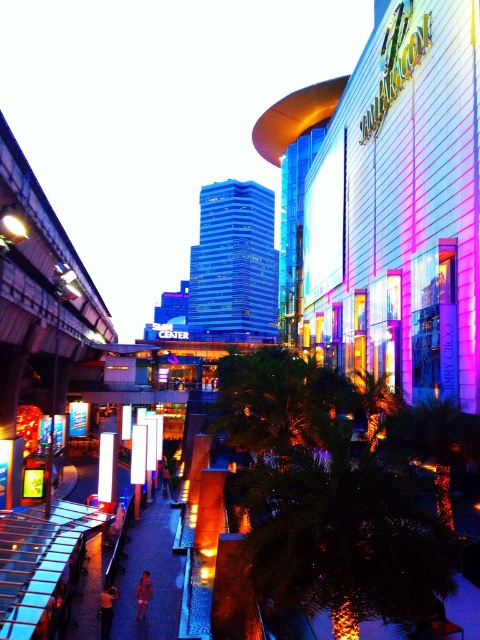
You are a photographer standing at the entrance of the shopping complex and see the orange fabric shirt at lower left and the pink fabric person at center in your viewfinder. Which object appears shorter in the photo?

The orange fabric shirt at lower left appears shorter than the pink fabric person at center because it is not as tall as the pink fabric person at center.

You are standing in the urban scene described. You see a point at coordinates (107, 609). Based on the scene description, can you determine what object this point is located on?

The point at coordinates (107, 609) is located on the orange fabric shirt at lower left.

From the picture: You are a fashion designer looking for inspiration from the scene. Where exactly is the orange fabric shirt at lower left located in the image?

The orange fabric shirt at lower left is located at point (107, 609).